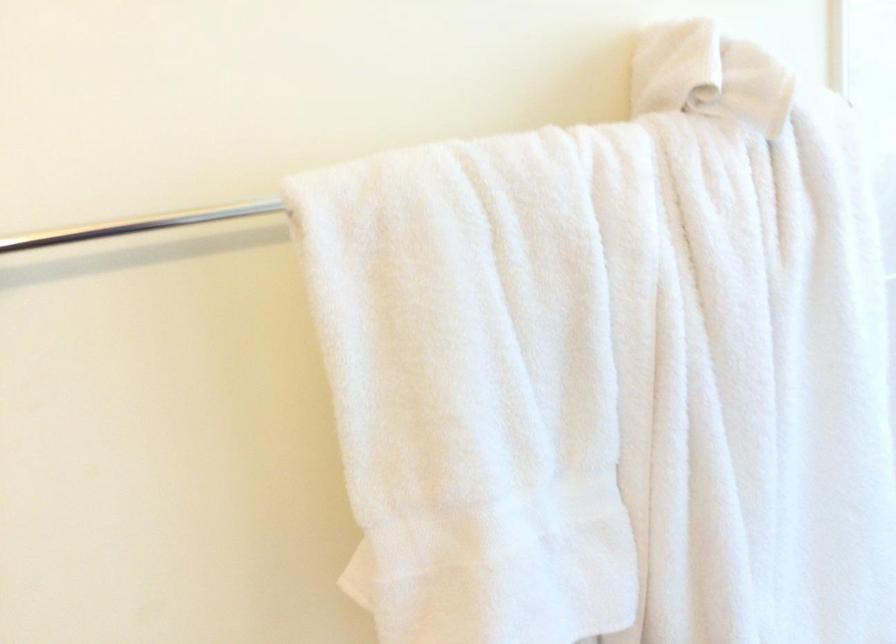
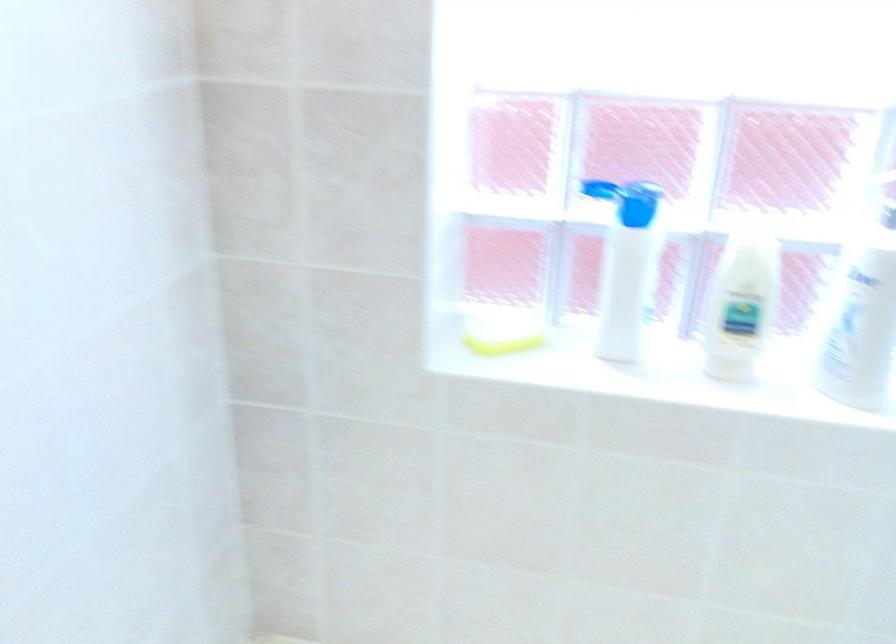
Question: Based on the continuous images, in which direction is the camera rotating? Reply with the corresponding letter.

Choices:
 (A) Left
 (B) Right
 (C) Up
 (D) Down

Answer: (B)